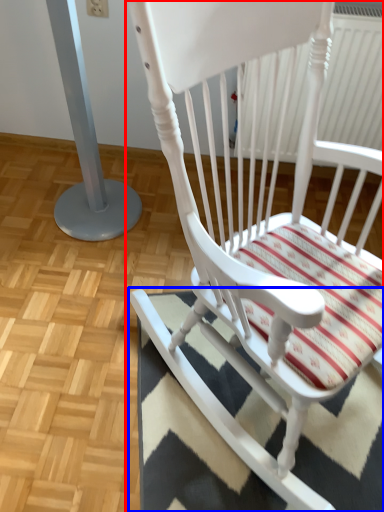
Question: Which object is further to the camera taking this photo, chair (highlighted by a red box) or doormat (highlighted by a blue box)?

Choices:
 (A) chair
 (B) doormat

Answer: (B)